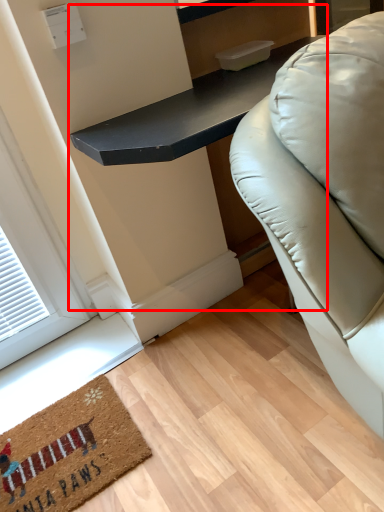
Question: From the image, what is the correct spatial relationship of table (annotated by the red box) in relation to mat?

Choices:
 (A) right
 (B) left

Answer: (A)